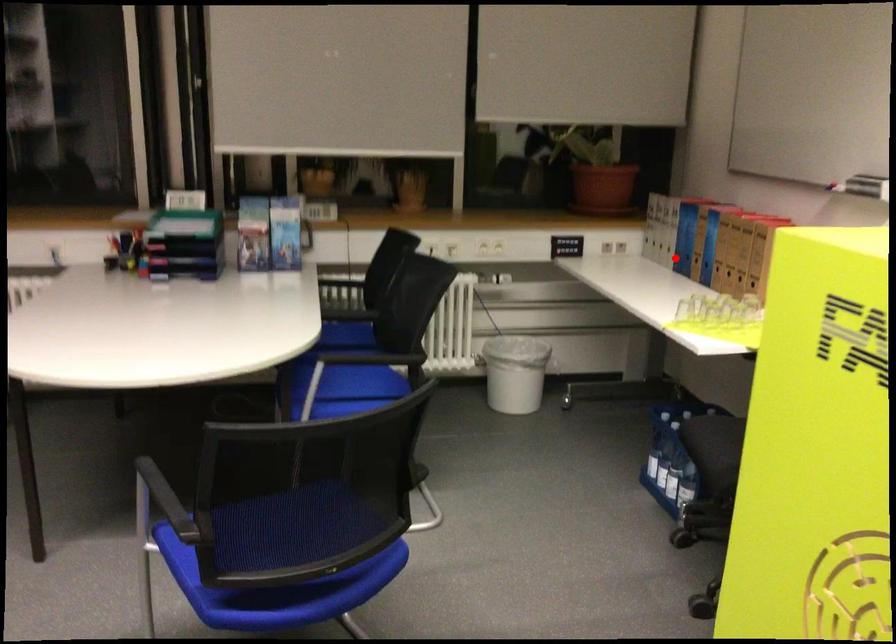
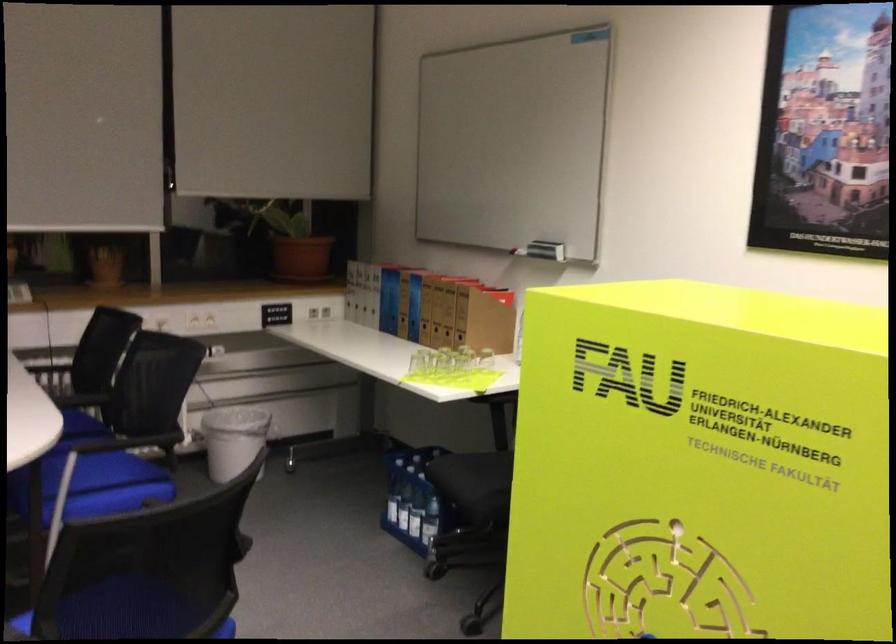
Question: I am providing you with two images of the same scene from different viewpoints. In image1, a red point is highlighted. Considering the same 3D point in image2, which of the following is correct?

Choices:
 (A) It is closer
 (B) It is farther

Answer: (B)